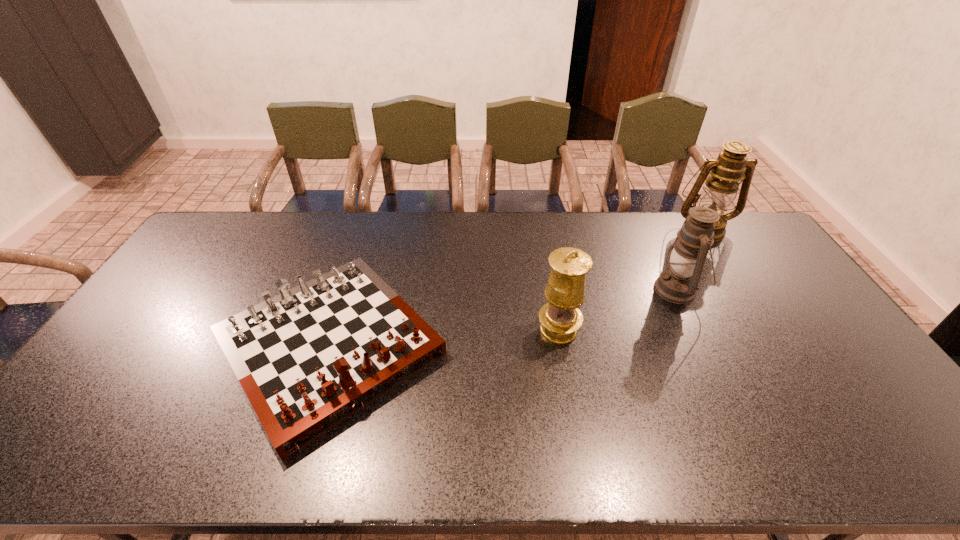
Choose which oil lamp is the nearest neighbor to the gameboard. Please provide its 2D coordinates. Your answer should be formatted as a tuple, i.e. [(x, y)], where the tuple contains the x and y coordinates of a point satisfying the conditions above.

[(560, 318)]

This screenshot has width=960, height=540. Identify the location of oil lamp that is the second closest to the farthest oil lamp. (560, 318).

Locate an element on the screen. This screenshot has width=960, height=540. free space that satisfies the following two spatial constraints: 1. on the back side of the shortest object; 2. on the left side of the farthest object is located at coordinates (368, 228).

I want to click on free space that satisfies the following two spatial constraints: 1. on the back side of the third object from left to right; 2. on the right side of the leftmost oil lamp, so click(552, 290).

This screenshot has width=960, height=540. I want to click on vacant space that satisfies the following two spatial constraints: 1. on the back side of the second farthest oil lamp; 2. on the left side of the farthest oil lamp, so click(x=648, y=228).